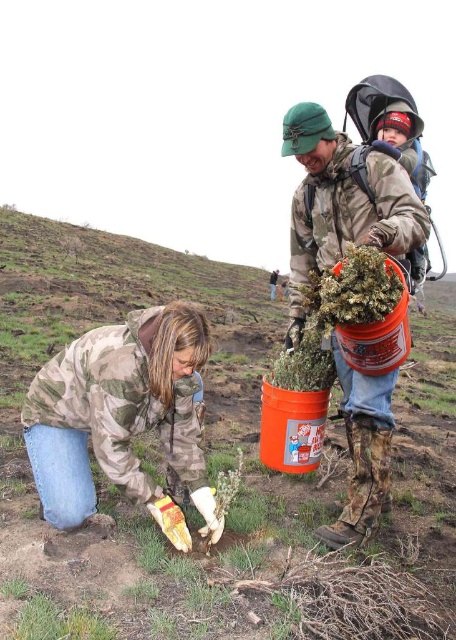
You are standing at the point marked by the coordinates point (150, 422). You want to walk towards the person on the left who is planting a shrub. How far will you have to walk to reach them?

The point (150, 422) is 3.10 meters away from the viewer, so you will have to walk 3.10 meters to reach the person on the left.

You are a hiker who has spotted two people in the distance working in a field. You see a camouflage jacket at lower left and a camouflage jacket at center. Which camouflage jacket is closer to you?

The camouflage jacket at lower left is smaller than the camouflage jacket at center, which indicates it is farther away. Therefore, the camouflage jacket at center is closer to you.